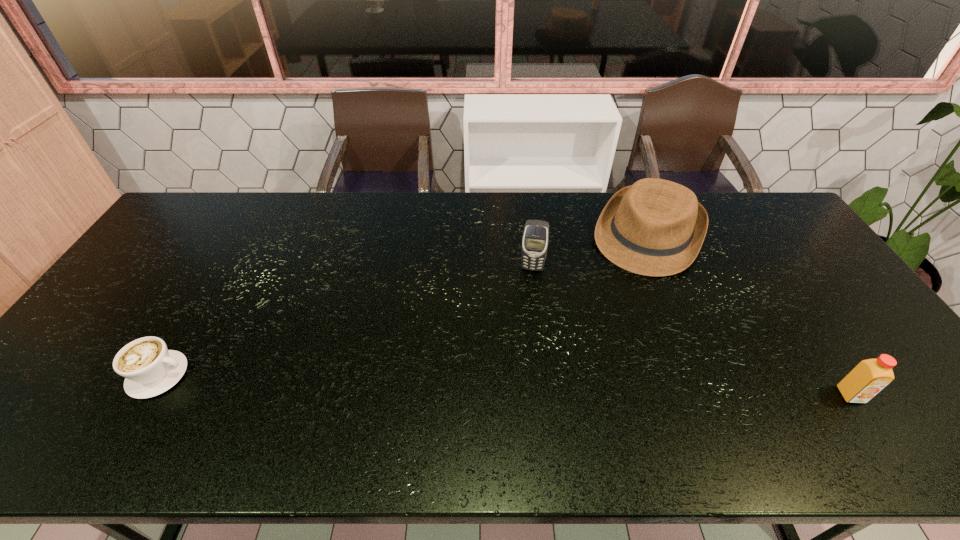
Where is `vacant area that lies between the fedora and the third object from right to left`? vacant area that lies between the fedora and the third object from right to left is located at coordinates (590, 252).

Locate an element on the screen. The height and width of the screenshot is (540, 960). vacant area that lies between the rightmost object and the fedora is located at coordinates (749, 315).

What are the coordinates of `vacant area between the tallest object and the orange juice` in the screenshot? It's located at (691, 332).

This screenshot has height=540, width=960. What are the coordinates of `vacant space that is in between the cellular telephone and the cappuccino` in the screenshot? It's located at click(346, 321).

Locate which object ranks second in proximity to the rightmost object. Please provide its 2D coordinates. Your answer should be formatted as a tuple, i.e. [(x, y)], where the tuple contains the x and y coordinates of a point satisfying the conditions above.

[(535, 239)]

Image resolution: width=960 pixels, height=540 pixels. Find the location of `object that is the third closest one to the cappuccino`. object that is the third closest one to the cappuccino is located at coordinates (870, 376).